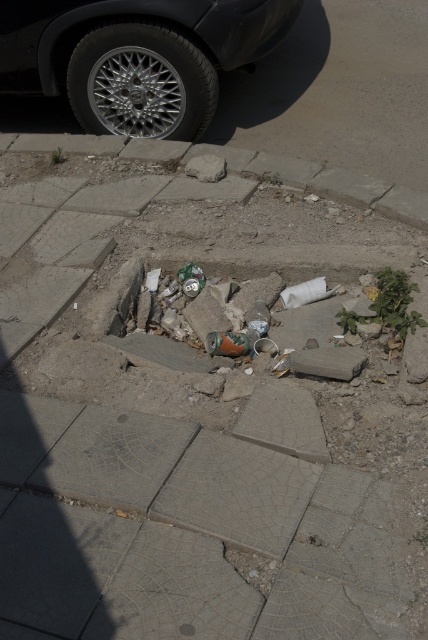
Question: Can you confirm if shiny black tire at upper left is positioned below gray concrete curb at lower center?

Choices:
 (A) no
 (B) yes

Answer: (A)

Question: Which object appears farthest from the camera in this image?

Choices:
 (A) shiny black tire at upper left
 (B) gray concrete curb at lower center
 (C) silver metallic tire at upper left

Answer: (C)

Question: Estimate the real-world distances between objects in this image. Which object is farther from the silver metallic tire at upper left?

Choices:
 (A) shiny black tire at upper left
 (B) gray concrete curb at lower center

Answer: (B)

Question: Does silver metallic tire at upper left have a larger size compared to gray concrete curb at lower center?

Choices:
 (A) no
 (B) yes

Answer: (A)

Question: Is shiny black tire at upper left to the left of silver metallic tire at upper left from the viewer's perspective?

Choices:
 (A) yes
 (B) no

Answer: (B)

Question: Among these objects, which one is nearest to the camera?

Choices:
 (A) silver metallic tire at upper left
 (B) shiny black tire at upper left
 (C) gray concrete curb at lower center

Answer: (C)